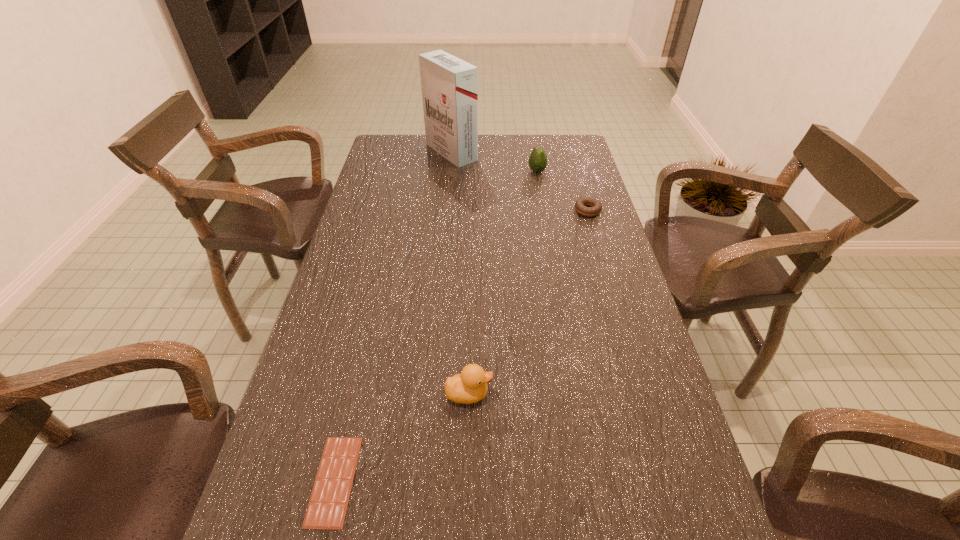
You are a GUI agent. You are given a task and a screenshot of the screen. Output one action in this format:
    pyautogui.click(x=<x>, y=<y>)
    Task: Click on the empty space that is in between the shortest object and the tallest object
    The width and height of the screenshot is (960, 540).
    Given the screenshot: What is the action you would take?
    pyautogui.click(x=393, y=316)

This screenshot has height=540, width=960. Find the location of `free spot between the shortest object and the cigarette case`. free spot between the shortest object and the cigarette case is located at coordinates (393, 316).

Identify the location of free spot between the cigarette case and the second nearest object. The width and height of the screenshot is (960, 540). (460, 273).

You are a GUI agent. You are given a task and a screenshot of the screen. Output one action in this format:
    pyautogui.click(x=<x>, y=<y>)
    Task: Click on the vacant area between the cigarette case and the duckling
    The width and height of the screenshot is (960, 540).
    Given the screenshot: What is the action you would take?
    click(460, 273)

Identify the location of vacant space that is in between the fourth tallest object and the shortest object. (461, 346).

At what (x,y) coordinates should I click in order to perform the action: click on free point between the rightmost object and the tallest object. Please return your answer as a coordinate pair (x, y). Image resolution: width=960 pixels, height=540 pixels. Looking at the image, I should click on point(519,181).

Find the location of a particular element. The height and width of the screenshot is (540, 960). vacant space that's between the shortest object and the third farthest object is located at coordinates (461, 346).

What are the coordinates of `free space between the avocado and the cigarette case` in the screenshot? It's located at (494, 162).

This screenshot has width=960, height=540. What are the coordinates of `vacant space that's between the nearest object and the duckling` in the screenshot? It's located at (401, 437).

Image resolution: width=960 pixels, height=540 pixels. I want to click on the closest object to the chocolate bar, so click(469, 386).